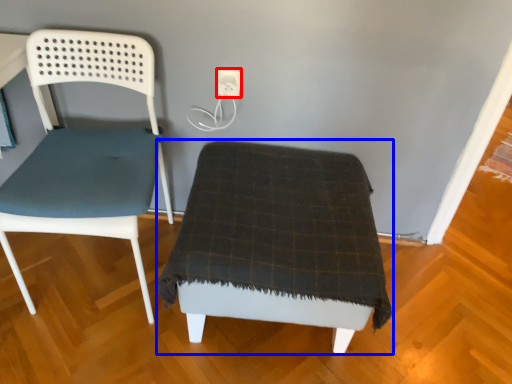
Question: Which point is closer to the camera, electric outlet (highlighted by a red box) or furniture (highlighted by a blue box)?

Choices:
 (A) electric outlet
 (B) furniture

Answer: (B)